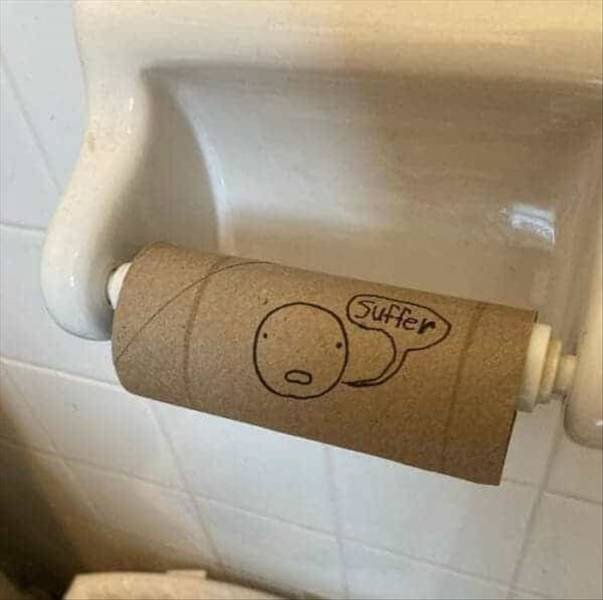
Where is `toilet seat`? toilet seat is located at coordinates (155, 573).